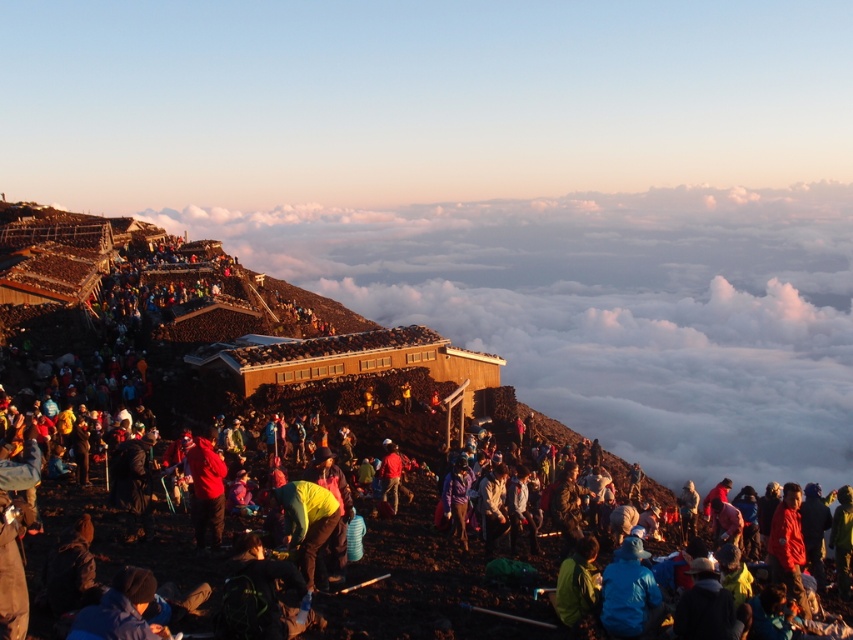
You are a photographer trying to capture a clear shot of the sunrise. You notice two yellow items at the center of the scene. Which one, the yellow jacket at center or the yellow fabric at center, is more likely to block your view of the sunrise if they are positioned between you and the sun?

The yellow jacket at center is wider than the yellow fabric at center, so it is more likely to block your view of the sunrise if positioned between you and the sun.

You are a drone operator tasked with capturing aerial footage of the mountain scene. You need to focus your camera on the yellow jacket at center. According to the coordinates provided, where should you direct your camera?

The yellow jacket at center is located at coordinates point (251, 372), so you should direct your camera to that point to capture it.